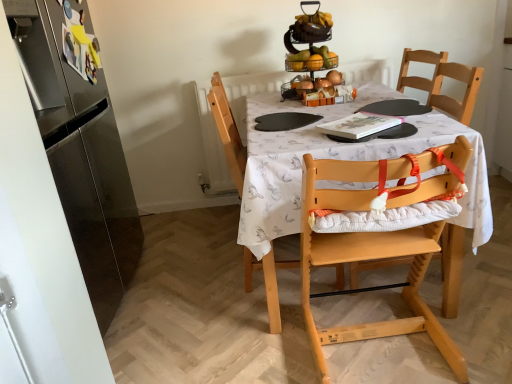
Question: Does light wood highchair at center, positioned as the 2th chair in back-to-front order, have a lesser height compared to wooden high chair at center?

Choices:
 (A) no
 (B) yes

Answer: (B)

Question: Is light wood highchair at center, the first chair in the front-to-back sequence, outside of wooden high chair at center?

Choices:
 (A) yes
 (B) no

Answer: (A)

Question: From the image's perspective, is light wood highchair at center, the first chair in the front-to-back sequence, over wooden high chair at center?

Choices:
 (A) yes
 (B) no

Answer: (B)

Question: Does light wood highchair at center, positioned as the 2th chair in back-to-front order, have a greater height compared to wooden high chair at center?

Choices:
 (A) no
 (B) yes

Answer: (A)

Question: Is light wood highchair at center, positioned as the 2th chair in back-to-front order, placed right next to wooden high chair at center?

Choices:
 (A) no
 (B) yes

Answer: (A)

Question: From the image's perspective, is metallic silver fruit basket at upper center located above or below light wood highchair at center, the first chair in the front-to-back sequence?

Choices:
 (A) below
 (B) above

Answer: (B)

Question: Is metallic silver fruit basket at upper center spatially inside light wood highchair at center, positioned as the 2th chair in back-to-front order, or outside of it?

Choices:
 (A) outside
 (B) inside

Answer: (A)

Question: Considering the positions of metallic silver fruit basket at upper center and light wood highchair at center, positioned as the 2th chair in back-to-front order, in the image, is metallic silver fruit basket at upper center bigger or smaller than light wood highchair at center, positioned as the 2th chair in back-to-front order,?

Choices:
 (A) big
 (B) small

Answer: (B)

Question: Considering the positions of point (324, 51) and point (320, 360), is point (324, 51) closer or farther from the camera than point (320, 360)?

Choices:
 (A) farther
 (B) closer

Answer: (A)

Question: Considering the relative positions of wooden high chair at center and light wood highchair at center, positioned as the 2th chair in back-to-front order, in the image provided, is wooden high chair at center to the left or to the right of light wood highchair at center, positioned as the 2th chair in back-to-front order,?

Choices:
 (A) left
 (B) right

Answer: (B)

Question: Relative to light wood highchair at center, positioned as the 2th chair in back-to-front order, is wooden high chair at center in front or behind?

Choices:
 (A) front
 (B) behind

Answer: (B)

Question: Is wooden high chair at center spatially inside light wood highchair at center, the first chair in the front-to-back sequence, or outside of it?

Choices:
 (A) outside
 (B) inside

Answer: (A)

Question: Considering the positions of wooden high chair at center and light wood highchair at center, the first chair in the front-to-back sequence, in the image, is wooden high chair at center taller or shorter than light wood highchair at center, the first chair in the front-to-back sequence,?

Choices:
 (A) tall
 (B) short

Answer: (A)

Question: Considering the positions of light wood highchair at center, which is the second chair in front-to-back order, and metallic silver fruit basket at upper center in the image, is light wood highchair at center, which is the second chair in front-to-back order, wider or thinner than metallic silver fruit basket at upper center?

Choices:
 (A) wide
 (B) thin

Answer: (A)

Question: From the image's perspective, relative to metallic silver fruit basket at upper center, is light wood highchair at center, which is the second chair in front-to-back order, above or below?

Choices:
 (A) below
 (B) above

Answer: (A)